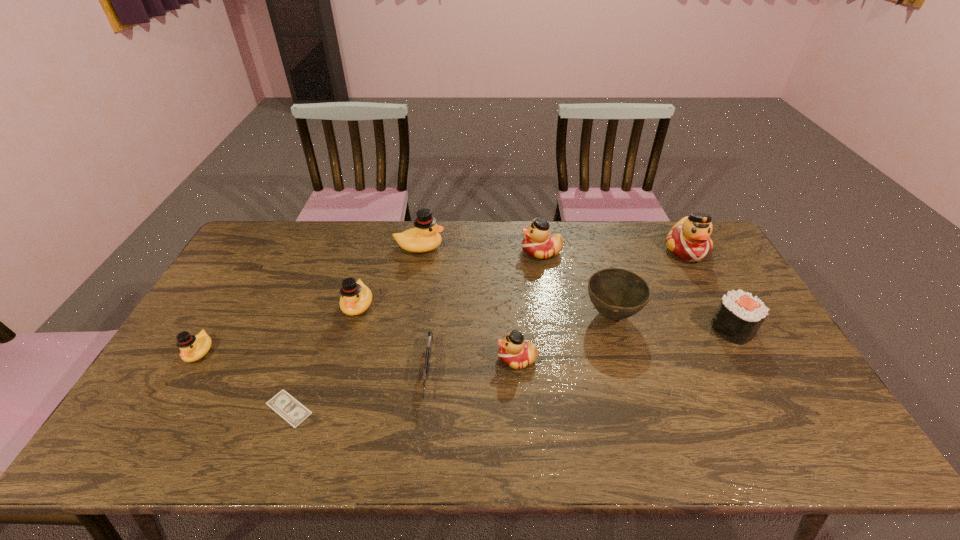
Locate an element on the screen. The width and height of the screenshot is (960, 540). the smallest red duck is located at coordinates coord(515,352).

The width and height of the screenshot is (960, 540). Identify the location of the leftmost yellow duck. (193, 348).

Identify the location of the smallest yellow duck. (193, 348).

You are a GUI agent. You are given a task and a screenshot of the screen. Output one action in this format:
    pyautogui.click(x=<x>, y=<y>)
    Task: Click on the grey gun
    This screenshot has height=540, width=960.
    Given the screenshot: What is the action you would take?
    pyautogui.click(x=428, y=348)

Find the location of a particular element. The image size is (960, 540). the ninth tallest object is located at coordinates (428, 348).

I want to click on the shortest object, so click(x=291, y=410).

Find the location of a particular element. The height and width of the screenshot is (540, 960). green money is located at coordinates (291, 410).

In order to click on vacant area situated on the face of the rightmost duck in this screenshot , I will do `click(719, 309)`.

Locate an element on the screen. The height and width of the screenshot is (540, 960). free space located 0.100m on the front-facing side of the farthest yellow duck is located at coordinates (473, 247).

This screenshot has width=960, height=540. In order to click on free region located on the face of the second biggest red duck in this screenshot , I will do `click(452, 252)`.